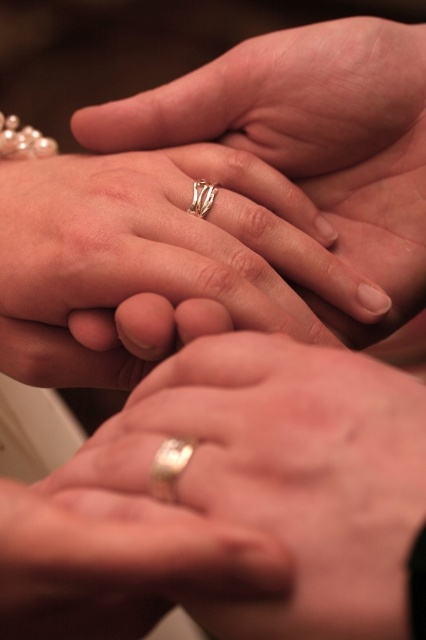
Consider the image. You are a photographer trying to focus on the gold metallic ring at center. What are the coordinates where you should adjust your camera focus to capture it perfectly?

The gold metallic ring at center is located at coordinates point (278, 476), so you should adjust your camera focus to that point to capture it perfectly.

You are a jeweler assessing two rings displayed in a catalog. The gold metallic ring at center and the silver metallic ring at center are shown side by side. Which ring has a greater width?

The gold metallic ring at center has a greater width than the silver metallic ring at center.